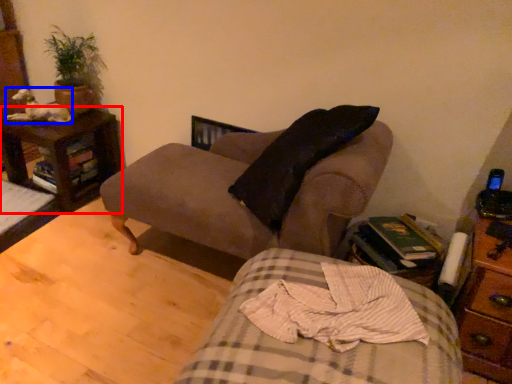
Question: Which object is closer to the camera taking this photo, nightstand (highlighted by a red box) or animal (highlighted by a blue box)?

Choices:
 (A) nightstand
 (B) animal

Answer: (A)